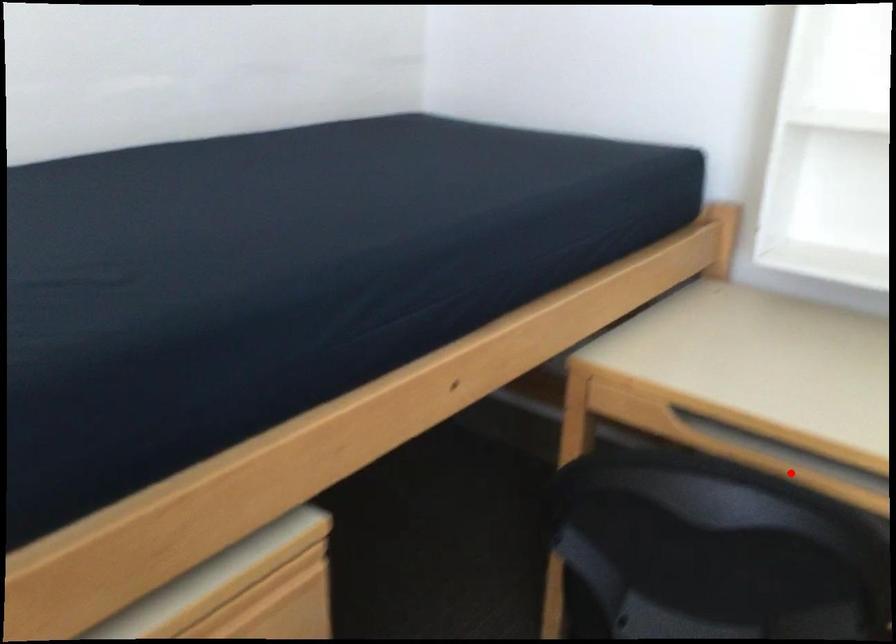
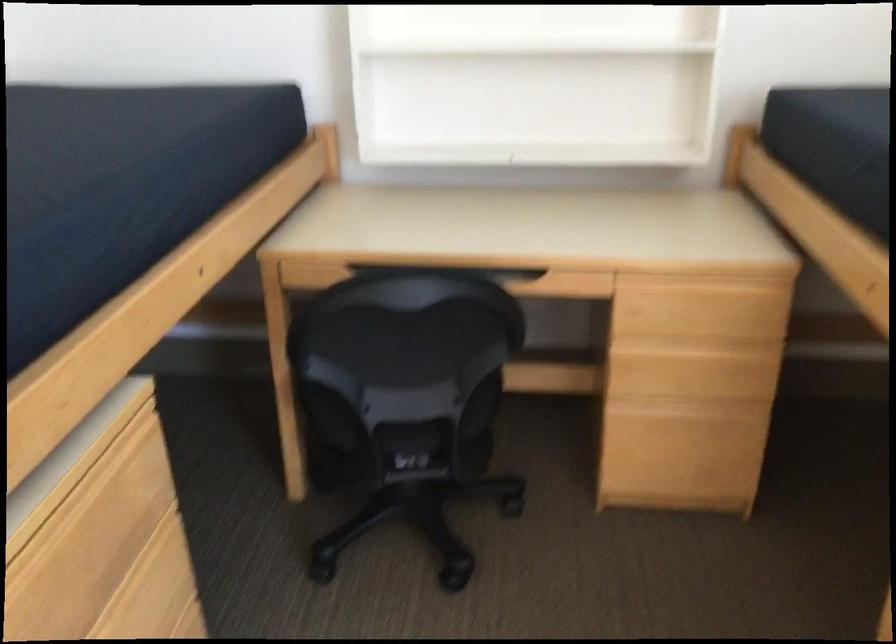
Question: I am providing you with two images of the same scene from different viewpoints. A red point is marked on the first image. At the location where the point appears in image 1, is it still visible in image 2?

Choices:
 (A) Yes
 (B) No

Answer: (B)